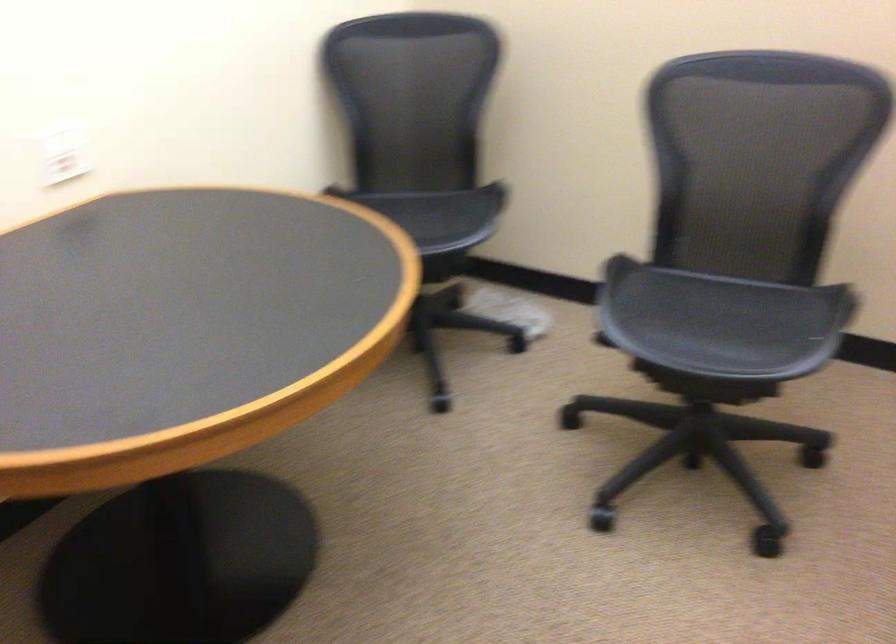
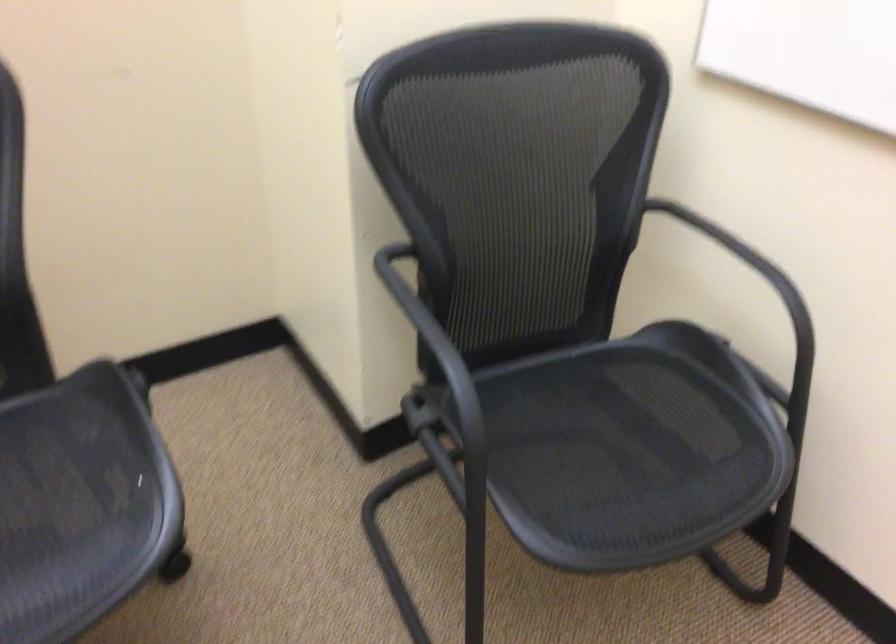
The point at (769, 335) is marked in the first image. Where is the corresponding point in the second image?

(80, 503)